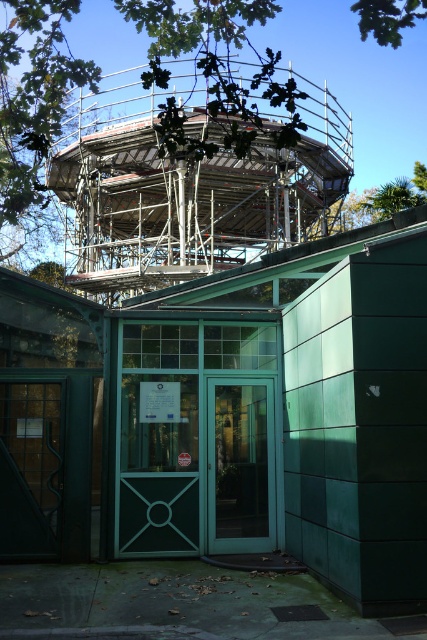
Question: Based on their relative distances, which object is farther from the green leafy tree at upper center?

Choices:
 (A) metallic scaffolding at upper center
 (B) green glass door at center
 (C) teal glass door at center

Answer: (A)

Question: Can you confirm if metallic scaffolding at upper center is positioned to the right of green leafy tree at upper center?

Choices:
 (A) yes
 (B) no

Answer: (B)

Question: Among these points, which one is nearest to the camera?

Choices:
 (A) (134, 336)
 (B) (26, 436)
 (C) (251, 490)
 (D) (312, 10)

Answer: (B)

Question: Which point is closer to the camera?

Choices:
 (A) green glass door at center
 (B) teal glass door at center
 (C) metallic scaffolding at upper center

Answer: (B)

Question: Does teal glass door at center have a lesser width compared to green glass door at center?

Choices:
 (A) no
 (B) yes

Answer: (A)

Question: Does metallic scaffolding at upper center appear under teal glass door at center?

Choices:
 (A) yes
 (B) no

Answer: (B)